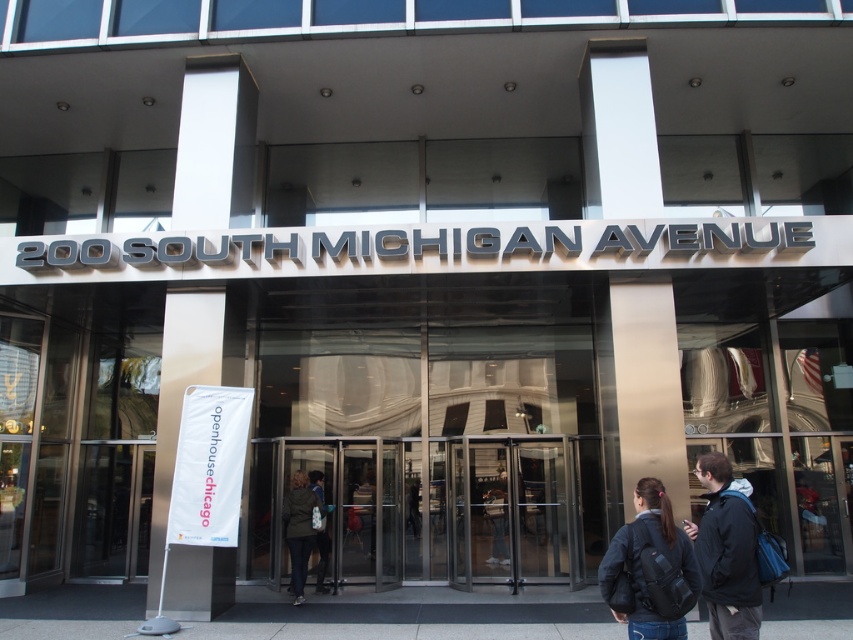
Question: Among these objects, which one is nearest to the camera?

Choices:
 (A) black matte jacket at lower right
 (B) green fabric coat at center

Answer: (A)

Question: Which of the following is the farthest from the observer?

Choices:
 (A) green fabric coat at center
 (B) black matte jacket at lower right

Answer: (A)

Question: Which of the following is the closest to the observer?

Choices:
 (A) (746, 522)
 (B) (296, 499)

Answer: (A)

Question: Can you confirm if black matte jacket at lower right is positioned to the right of green fabric coat at center?

Choices:
 (A) no
 (B) yes

Answer: (B)

Question: Considering the relative positions of black backpack at center and green fabric coat at center in the image provided, where is black backpack at center located with respect to green fabric coat at center?

Choices:
 (A) above
 (B) below

Answer: (A)

Question: From the image, what is the correct spatial relationship of black matte jacket at lower right in relation to green fabric coat at center?

Choices:
 (A) below
 (B) above

Answer: (B)